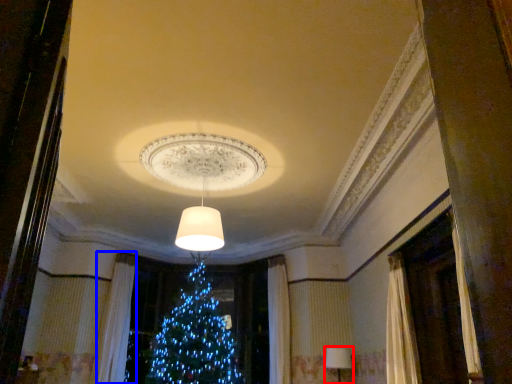
Question: Which of the following is the closest to the observer, lamp (highlighted by a red box) or curtain (highlighted by a blue box)?

Choices:
 (A) lamp
 (B) curtain

Answer: (A)